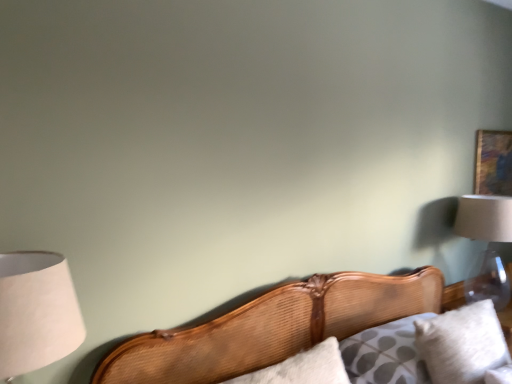
Question: From the image's perspective, is wooden cushion at lower right located above clear glass lampshade at upper right, the second lamp positioned from the left?

Choices:
 (A) no
 (B) yes

Answer: (A)

Question: From the image's perspective, is wooden cushion at lower right under clear glass lampshade at upper right, positioned as the 1th lamp in right-to-left order?

Choices:
 (A) yes
 (B) no

Answer: (A)

Question: Is wooden cushion at lower right at the left side of clear glass lampshade at upper right, which appears as the 1th lamp when viewed from the back?

Choices:
 (A) yes
 (B) no

Answer: (A)

Question: Does wooden cushion at lower right come behind clear glass lampshade at upper right, the second lamp positioned from the left?

Choices:
 (A) no
 (B) yes

Answer: (A)

Question: Is wooden cushion at lower right with clear glass lampshade at upper right, which appears as the 1th lamp when viewed from the back?

Choices:
 (A) yes
 (B) no

Answer: (B)

Question: Based on their sizes in the image, would you say white paper lampshade at left, marked as the first lamp in a left-to-right arrangement, is bigger or smaller than clear glass lampshade at upper right, which appears as the 1th lamp when viewed from the back?

Choices:
 (A) big
 (B) small

Answer: (B)

Question: Is white paper lampshade at left, which appears as the 1th lamp when viewed from the front, inside the boundaries of clear glass lampshade at upper right, which appears as the 1th lamp when viewed from the back, or outside?

Choices:
 (A) inside
 (B) outside

Answer: (B)

Question: Looking at their shapes, would you say white paper lampshade at left, arranged as the second lamp when viewed from the right, is wider or thinner than clear glass lampshade at upper right, the second lamp positioned from the left?

Choices:
 (A) wide
 (B) thin

Answer: (B)

Question: From a real-world perspective, is white paper lampshade at left, the 2th lamp from the back, above or below clear glass lampshade at upper right, which appears as the 1th lamp when viewed from the back?

Choices:
 (A) below
 (B) above

Answer: (B)

Question: Does point (487, 345) appear closer or farther from the camera than point (59, 321)?

Choices:
 (A) farther
 (B) closer

Answer: (A)

Question: From the image's perspective, is white soft pillow at lower right positioned above or below white paper lampshade at left, marked as the first lamp in a left-to-right arrangement?

Choices:
 (A) above
 (B) below

Answer: (B)

Question: In terms of size, does white soft pillow at lower right appear bigger or smaller than white paper lampshade at left, arranged as the second lamp when viewed from the right?

Choices:
 (A) big
 (B) small

Answer: (A)

Question: Do you think white soft pillow at lower right is within white paper lampshade at left, which appears as the 1th lamp when viewed from the front, or outside of it?

Choices:
 (A) outside
 (B) inside

Answer: (A)

Question: Does point (2, 304) appear closer or farther from the camera than point (442, 362)?

Choices:
 (A) closer
 (B) farther

Answer: (A)

Question: Is white paper lampshade at left, marked as the first lamp in a left-to-right arrangement, situated inside wooden cushion at lower right or outside?

Choices:
 (A) inside
 (B) outside

Answer: (B)